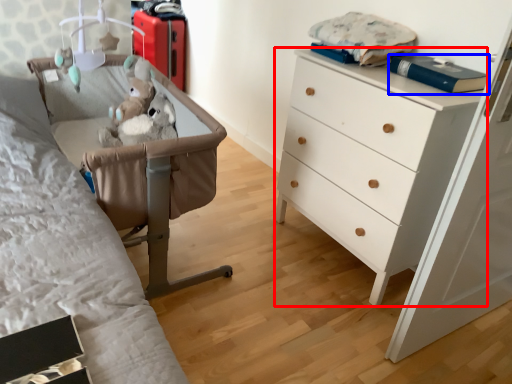
Question: Which of the following is the closest to the observer, chest of drawers (highlighted by a red box) or book (highlighted by a blue box)?

Choices:
 (A) chest of drawers
 (B) book

Answer: (A)